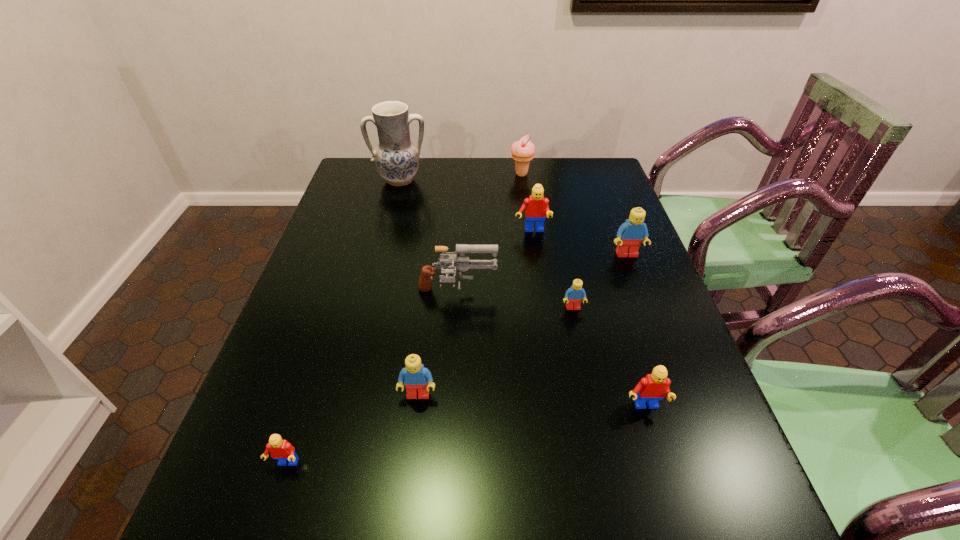
The image size is (960, 540). Identify the location of empty location between the nearest Lego and the second farthest red Lego. (465, 436).

At what (x,y) coordinates should I click in order to perform the action: click on free space that is in between the tallest object and the nearest red Lego. Please return your answer as a coordinate pair (x, y). Image resolution: width=960 pixels, height=540 pixels. Looking at the image, I should click on (343, 322).

Identify which object is located as the second nearest to the rightmost blue Lego. Please provide its 2D coordinates. Your answer should be formatted as a tuple, i.e. [(x, y)], where the tuple contains the x and y coordinates of a point satisfying the conditions above.

[(575, 294)]

Locate which object ranks seventh in proximity to the rightmost red Lego. Please provide its 2D coordinates. Your answer should be formatted as a tuple, i.e. [(x, y)], where the tuple contains the x and y coordinates of a point satisfying the conditions above.

[(523, 151)]

Locate which Lego is the sixth closest to the icecream. Please provide its 2D coordinates. Your answer should be formatted as a tuple, i.e. [(x, y)], where the tuple contains the x and y coordinates of a point satisfying the conditions above.

[(280, 449)]

At what (x,y) coordinates should I click in order to perform the action: click on the third closest Lego to the rightmost red Lego. Please return your answer as a coordinate pair (x, y). Looking at the image, I should click on (630, 234).

Identify the location of the second closest blue Lego to the second nearest red Lego. This screenshot has width=960, height=540. (417, 379).

Locate an element on the screen. the closest blue Lego to the second nearest red Lego is located at coordinates (575, 294).

You are a GUI agent. You are given a task and a screenshot of the screen. Output one action in this format:
    pyautogui.click(x=<x>, y=<y>)
    Task: Click on the red Lego that stands as the closest to the second smallest red Lego
    The image size is (960, 540).
    Given the screenshot: What is the action you would take?
    pyautogui.click(x=536, y=206)

Point out which red Lego is positioned as the nearest to the nearest blue Lego. Please provide its 2D coordinates. Your answer should be formatted as a tuple, i.e. [(x, y)], where the tuple contains the x and y coordinates of a point satisfying the conditions above.

[(280, 449)]